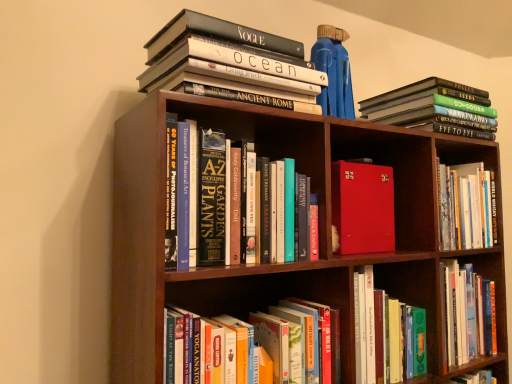
Question: Is hardcover book at upper left, which is the 5th book in bottom-to-top order, shorter than hardcover book at lower center, the 5th book positioned from the top?

Choices:
 (A) no
 (B) yes

Answer: (B)

Question: Is hardcover book at upper left, which is the 5th book in bottom-to-top order, oriented towards hardcover book at lower center, which ranks as the first book in bottom-to-top order?

Choices:
 (A) no
 (B) yes

Answer: (A)

Question: Is hardcover book at upper left, which is the 5th book in bottom-to-top order, outside hardcover book at lower center, which ranks as the first book in bottom-to-top order?

Choices:
 (A) yes
 (B) no

Answer: (A)

Question: Is hardcover book at upper left, which is the 5th book in bottom-to-top order, to the left of hardcover book at lower center, which ranks as the first book in bottom-to-top order, from the viewer's perspective?

Choices:
 (A) no
 (B) yes

Answer: (B)

Question: Does hardcover book at upper left, which is the 5th book in bottom-to-top order, have a lesser width compared to hardcover book at lower center, which ranks as the first book in bottom-to-top order?

Choices:
 (A) no
 (B) yes

Answer: (A)

Question: Considering the positions of hardcover books at upper right, which is the 4th book in bottom-to-top order, and red leather-bound book at center, which is the fourth book in top-to-bottom order, in the image, is hardcover books at upper right, which is the 4th book in bottom-to-top order, wider or thinner than red leather-bound book at center, which is the fourth book in top-to-bottom order,?

Choices:
 (A) thin
 (B) wide

Answer: (B)

Question: Looking at the image, does hardcover books at upper right, positioned as the 2th book in top-to-bottom order, seem bigger or smaller compared to red leather-bound book at center, which is counted as the 2th book, starting from the bottom?

Choices:
 (A) big
 (B) small

Answer: (A)

Question: From their relative heights in the image, would you say hardcover books at upper right, which is the 4th book in bottom-to-top order, is taller or shorter than red leather-bound book at center, which is counted as the 2th book, starting from the bottom?

Choices:
 (A) short
 (B) tall

Answer: (A)

Question: From the image's perspective, is hardcover books at upper right, positioned as the 2th book in top-to-bottom order, positioned above or below red leather-bound book at center, which is the fourth book in top-to-bottom order?

Choices:
 (A) below
 (B) above

Answer: (B)

Question: Is point (373, 175) closer or farther from the camera than point (192, 16)?

Choices:
 (A) farther
 (B) closer

Answer: (A)

Question: Is red leather-bound book at center, which is counted as the 2th book, starting from the bottom, taller or shorter than hardcover book at upper left, the 1th book positioned from the top?

Choices:
 (A) short
 (B) tall

Answer: (B)

Question: From a real-world perspective, is red leather-bound book at center, which is the fourth book in top-to-bottom order, physically located above or below hardcover book at upper left, which is the 5th book in bottom-to-top order?

Choices:
 (A) below
 (B) above

Answer: (A)

Question: Visually, is red leather-bound book at center, which is counted as the 2th book, starting from the bottom, positioned to the left or to the right of hardcover book at upper left, the 1th book positioned from the top?

Choices:
 (A) left
 (B) right

Answer: (B)

Question: Is hardcover book at lower center, the 5th book positioned from the top, inside the boundaries of red leather-bound book at center, which is counted as the 2th book, starting from the bottom, or outside?

Choices:
 (A) inside
 (B) outside

Answer: (B)

Question: Is point pos(201,339) closer or farther from the camera than point pos(357,243)?

Choices:
 (A) closer
 (B) farther

Answer: (A)